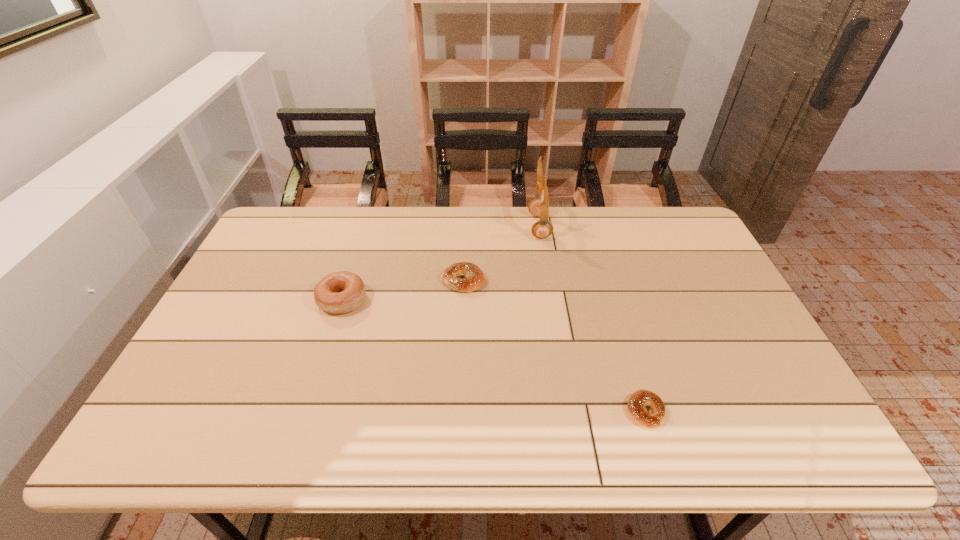
The image size is (960, 540). What are the coordinates of `vacant space that satisfies the following two spatial constraints: 1. on the front-facing side of the third object from left to right; 2. on the back side of the nearest bagel` in the screenshot? It's located at (569, 411).